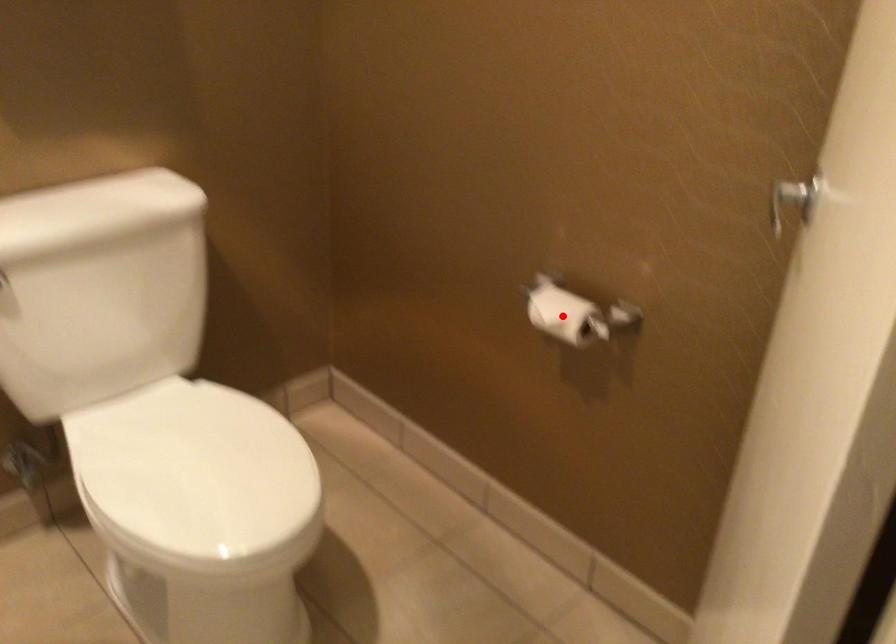
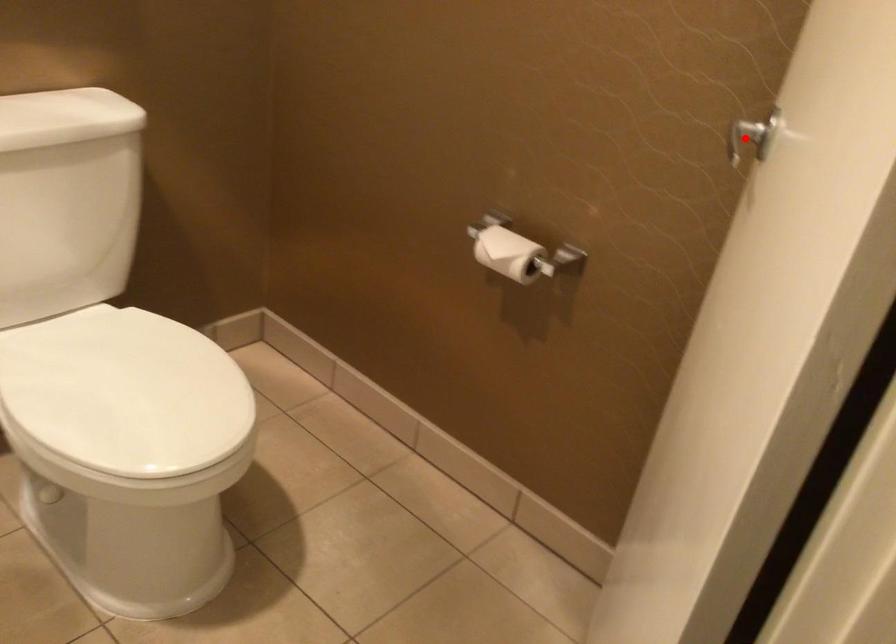
I am providing you with two images of the same scene from different viewpoints. A red point is marked on the first image and another point is marked on the second image. Do the highlighted points in image1 and image2 indicate the same real-world spot?

No